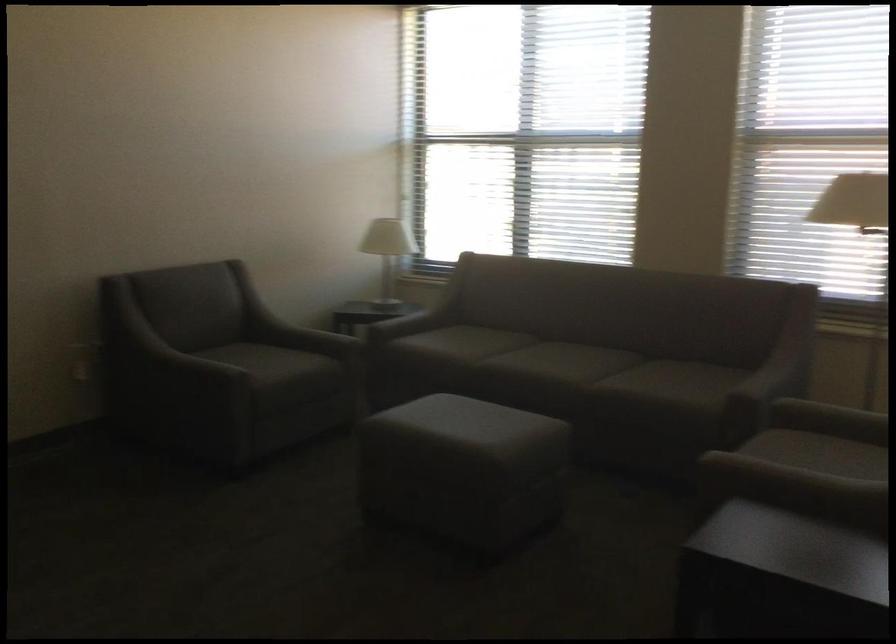
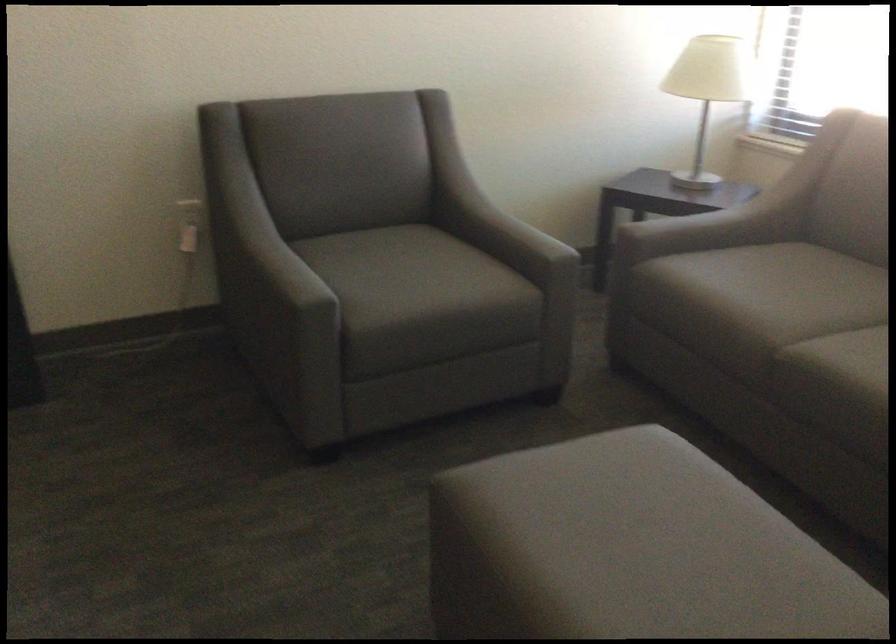
The point at (462,417) is marked in the first image. Where is the corresponding point in the second image?

(633, 542)